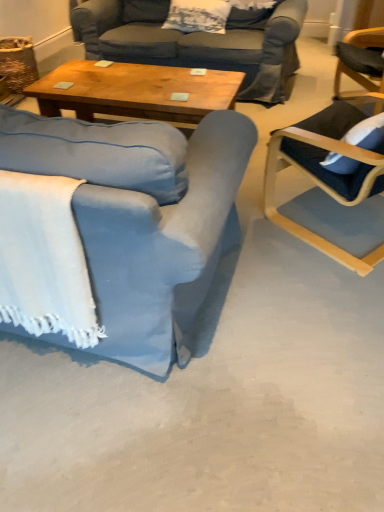
Question: Is wooden coffee table at center at the right side of white woven blanket at lower left?

Choices:
 (A) no
 (B) yes

Answer: (B)

Question: Does wooden coffee table at center have a lesser height compared to white woven blanket at lower left?

Choices:
 (A) yes
 (B) no

Answer: (A)

Question: Is wooden coffee table at center turned away from white woven blanket at lower left?

Choices:
 (A) no
 (B) yes

Answer: (B)

Question: Is wooden coffee table at center further to camera compared to white woven blanket at lower left?

Choices:
 (A) yes
 (B) no

Answer: (A)

Question: Is wooden coffee table at center taller than white woven blanket at lower left?

Choices:
 (A) yes
 (B) no

Answer: (B)

Question: From the image's perspective, would you say wooden coffee table at center is shown under white woven blanket at lower left?

Choices:
 (A) no
 (B) yes

Answer: (A)

Question: Is blue fabric chair at left, marked as the 1th chair in a left-to-right arrangement, looking in the opposite direction of dark blue fabric chair at right, which ranks as the 1th chair in right-to-left order?

Choices:
 (A) yes
 (B) no

Answer: (B)

Question: Does blue fabric chair at left, which is the 2th chair from right to left, have a greater height compared to dark blue fabric chair at right, which ranks as the 1th chair in right-to-left order?

Choices:
 (A) yes
 (B) no

Answer: (B)

Question: From the image's perspective, does blue fabric chair at left, which is the 2th chair from right to left, appear higher than dark blue fabric chair at right, which ranks as the 1th chair in right-to-left order?

Choices:
 (A) no
 (B) yes

Answer: (A)

Question: Does blue fabric chair at left, marked as the 1th chair in a left-to-right arrangement, touch dark blue fabric chair at right, the 2th chair when ordered from left to right?

Choices:
 (A) yes
 (B) no

Answer: (B)

Question: From a real-world perspective, does blue fabric chair at left, marked as the 1th chair in a left-to-right arrangement, stand above dark blue fabric chair at right, which ranks as the 1th chair in right-to-left order?

Choices:
 (A) yes
 (B) no

Answer: (B)

Question: Is blue fabric chair at left, which is the 2th chair from right to left, surrounding dark blue fabric chair at right, the 2th chair when ordered from left to right?

Choices:
 (A) no
 (B) yes

Answer: (A)

Question: Is blue fabric chair at left, marked as the 1th chair in a left-to-right arrangement, wider than white textured pillow at upper center?

Choices:
 (A) yes
 (B) no

Answer: (A)